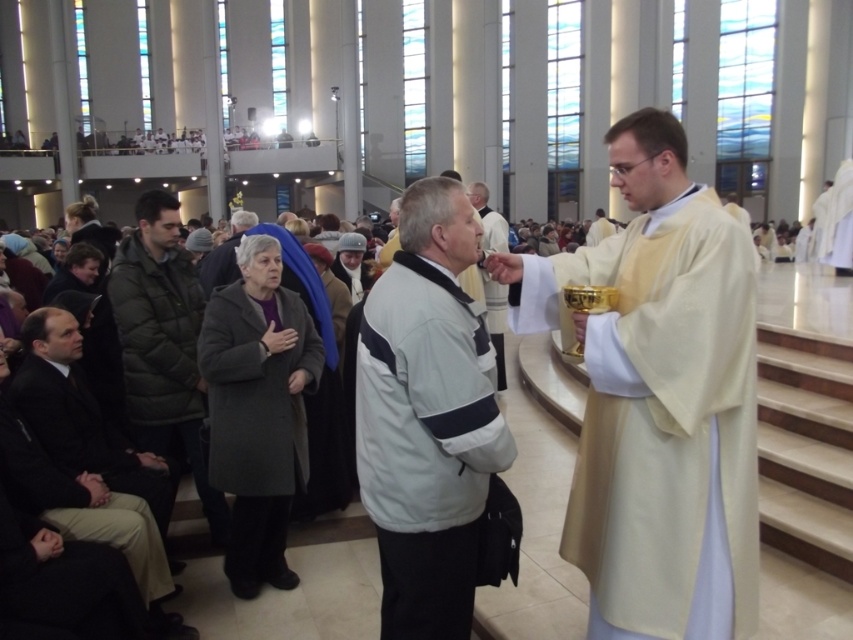
Which is above, gray woolen coat at center or white matte jacket at center?

Positioned higher is white matte jacket at center.

Who is more forward, (252, 454) or (495, 218)?

Point (252, 454) is in front.

Find the location of `gray woolen coat at center`. gray woolen coat at center is located at coordinates (254, 394).

Between gray fabric jacket at center and gray woolen coat at center, which one is positioned higher?

gray fabric jacket at center is above.

Is gray fabric jacket at center positioned in front of gray woolen coat at center?

That is True.

Measure the distance between point (479, 493) and camera.

Point (479, 493) is 4.82 meters from camera.

Identify the location of gray fabric jacket at center. The image size is (853, 640). (427, 417).

Can you confirm if light beige fabric robe at right is shorter than white matte jacket at center?

In fact, light beige fabric robe at right may be taller than white matte jacket at center.

Is point (643, 353) more distant than point (498, 388)?

No, (643, 353) is closer to viewer.

The image size is (853, 640). I want to click on light beige fabric robe at right, so click(x=659, y=400).